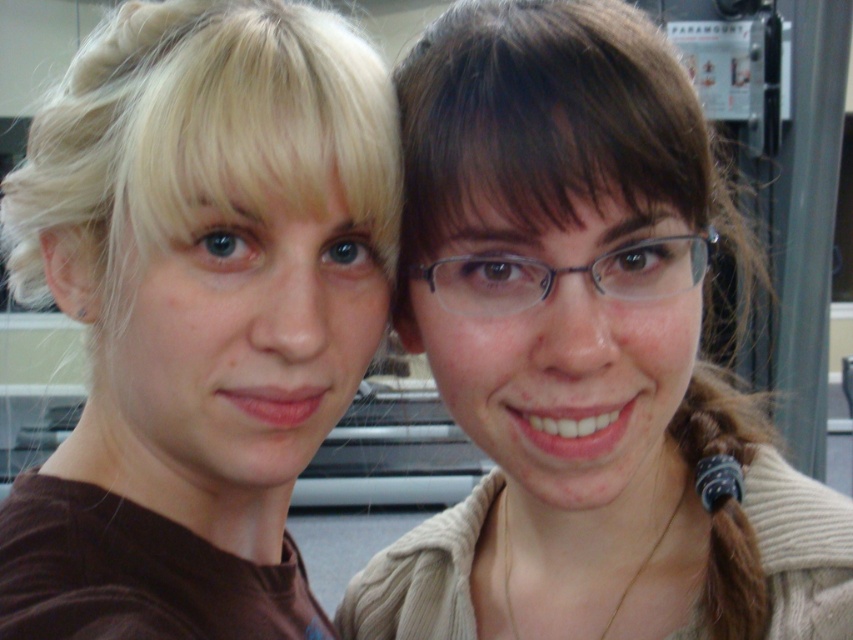
Question: In this image, where is brown matte shirt at left located relative to clear plastic glasses at center?

Choices:
 (A) left
 (B) right

Answer: (A)

Question: Which point is closer to the camera?

Choices:
 (A) brown matte shirt at left
 (B) light brown sweater at center
 (C) clear plastic glasses at center

Answer: (A)

Question: Does light brown sweater at center have a larger size compared to brown matte shirt at left?

Choices:
 (A) yes
 (B) no

Answer: (A)

Question: Can you confirm if light brown sweater at center is positioned below brown matte shirt at left?

Choices:
 (A) yes
 (B) no

Answer: (A)

Question: Estimate the real-world distances between objects in this image. Which object is farther from the brown matte shirt at left?

Choices:
 (A) clear plastic glasses at center
 (B) light brown sweater at center

Answer: (A)

Question: Which point is farther to the camera?

Choices:
 (A) light brown sweater at center
 (B) brown matte shirt at left

Answer: (A)